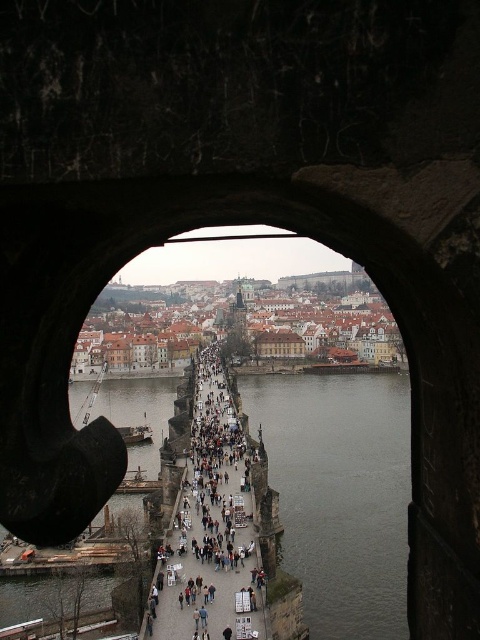
You are standing on the light brown wooden bridge at center and want to cross to the other side. Can you see the dark gray water at center from your current position?

Yes, because the dark gray water at center is larger in size than the light brown wooden bridge at center, it is visible from your position on the bridge.

You are standing at the arched stone structure and want to take a photo of the two points on the bridge below. The first point is at coordinates point (399,388) and the second is at point (201,588). Which point will appear closer to the camera in your photo?

Point (399,388) is further to the viewer than point (201,588), so in the photo, point (201,588) will appear closer to the camera.